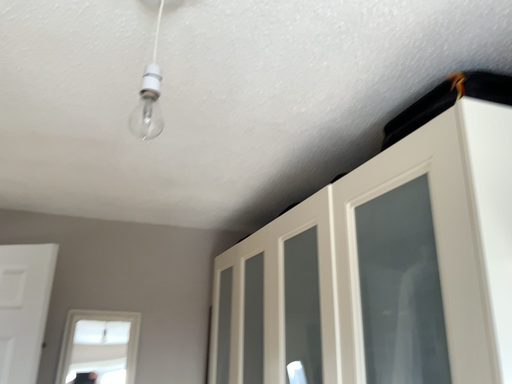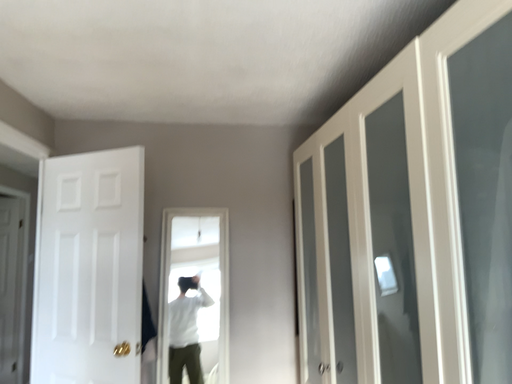
Question: How did the camera likely rotate when shooting the video?

Choices:
 (A) rotated left
 (B) rotated right

Answer: (A)